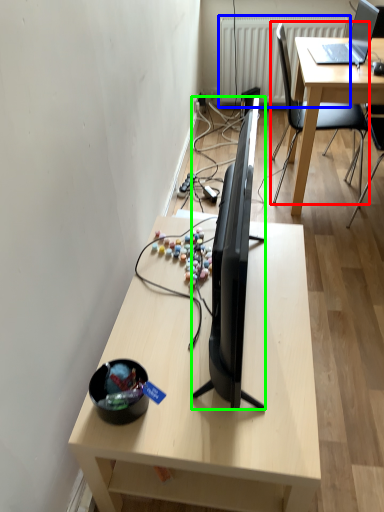
Question: Which object is the farthest from chair (highlighted by a red box)? Choose among these: radiator (highlighted by a blue box) or television (highlighted by a green box).

Choices:
 (A) radiator
 (B) television

Answer: (B)